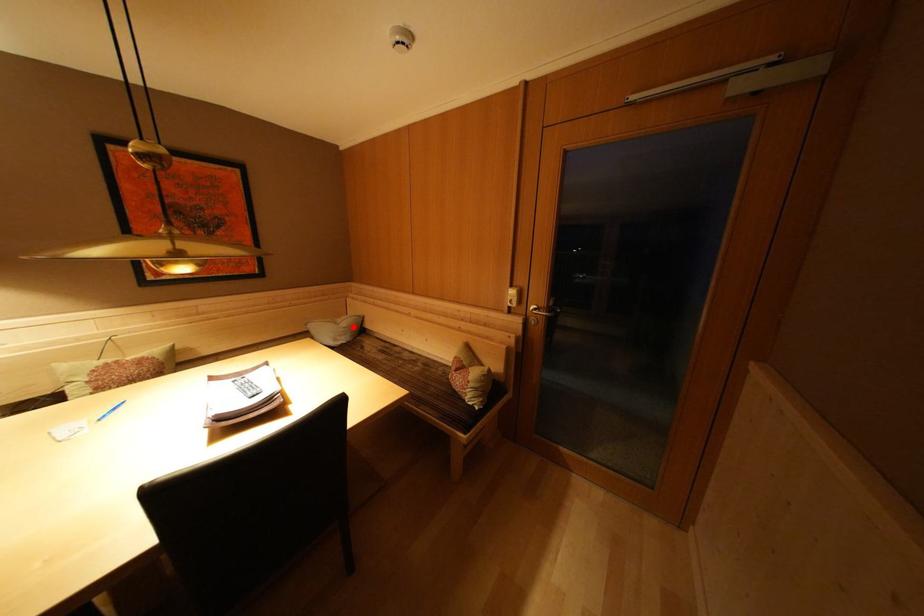
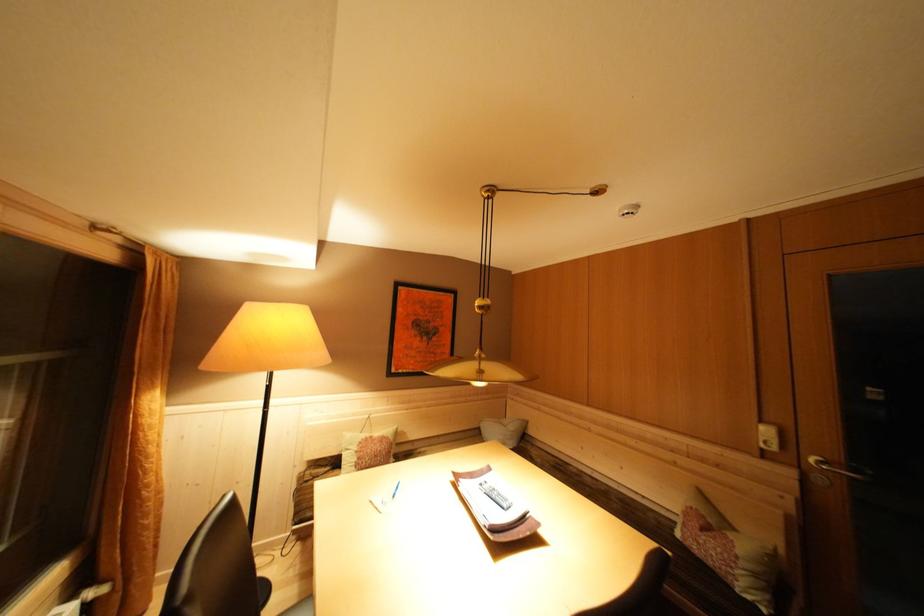
In the second image, find the point that corresponds to the highlighted location in the first image.

(518, 430)